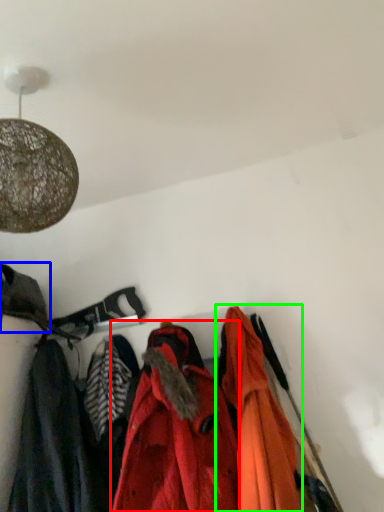
Question: Which object is the closest to the jacket (highlighted by a red box)? Choose among these: cloak (highlighted by a blue box) or jacket (highlighted by a green box).

Choices:
 (A) cloak
 (B) jacket

Answer: (B)